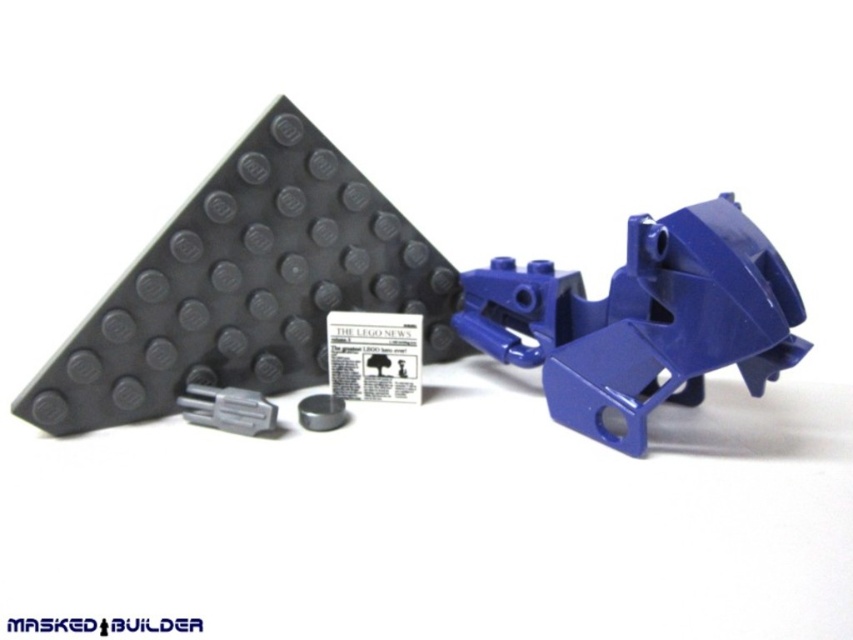
Question: Does matte blue plastic motorcycle at center-right have a lesser width compared to glossy plastic motorcycle at right?

Choices:
 (A) yes
 (B) no

Answer: (B)

Question: Does matte blue plastic motorcycle at center-right appear over gray matte plastic connector at lower left?

Choices:
 (A) no
 (B) yes

Answer: (B)

Question: Is glossy plastic motorcycle at right bigger than gray matte plastic connector at lower left?

Choices:
 (A) no
 (B) yes

Answer: (B)

Question: Which object appears farthest from the camera in this image?

Choices:
 (A) matte blue plastic motorcycle at center-right
 (B) gray matte plastic connector at lower left
 (C) glossy plastic motorcycle at right

Answer: (B)

Question: Among these objects, which one is farthest from the camera?

Choices:
 (A) matte blue plastic motorcycle at center-right
 (B) gray matte plastic connector at lower left

Answer: (B)

Question: Among these points, which one is nearest to the camera?

Choices:
 (A) (245, 422)
 (B) (596, 365)
 (C) (537, 339)

Answer: (B)